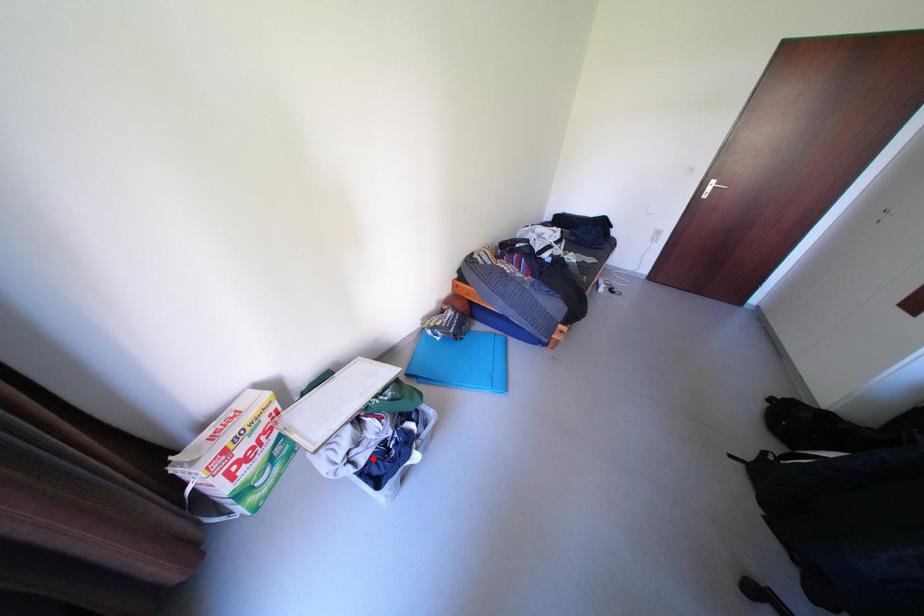
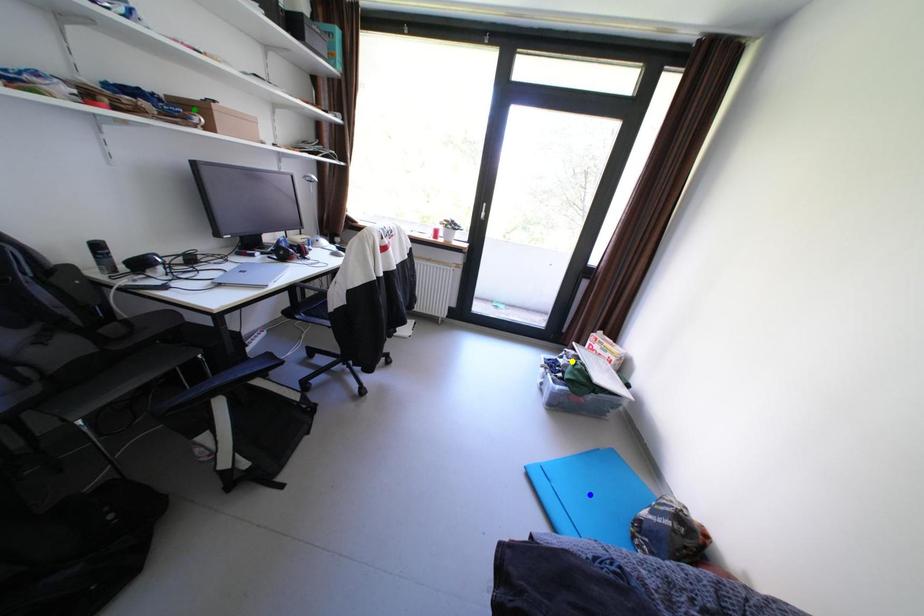
Question: I am providing you with two images of the same scene from different viewpoints. A red point is marked on the first image. You are given multiple points on the second image. Which mark in image 2 goes with the point in image 1?

Choices:
 (A) yellow point
 (B) green point
 (C) blue point

Answer: (A)